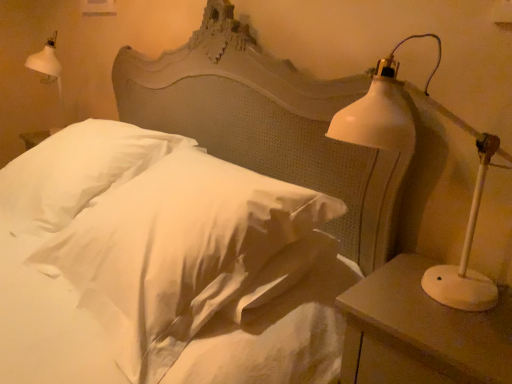
Question: Considering the relative sizes of white soft pillow at center, the 2th pillow in the right-to-left sequence, and white matte nightstand at right in the image provided, is white soft pillow at center, the 2th pillow in the right-to-left sequence, taller than white matte nightstand at right?

Choices:
 (A) yes
 (B) no

Answer: (B)

Question: Is white soft pillow at center, the first pillow from the left, smaller than white matte nightstand at right?

Choices:
 (A) yes
 (B) no

Answer: (B)

Question: Is white matte nightstand at right located within white soft pillow at center, the first pillow from the left?

Choices:
 (A) yes
 (B) no

Answer: (B)

Question: Would you say white soft pillow at center, the 2th pillow in the right-to-left sequence, is outside white matte nightstand at right?

Choices:
 (A) yes
 (B) no

Answer: (A)

Question: Are white soft pillow at center, the 2th pillow in the right-to-left sequence, and white matte nightstand at right far apart?

Choices:
 (A) no
 (B) yes

Answer: (B)

Question: Is point (437, 271) closer or farther from the camera than point (134, 160)?

Choices:
 (A) farther
 (B) closer

Answer: (B)

Question: Looking at the image, does white matte lamp at right seem bigger or smaller compared to white soft pillow at center, the first pillow from the left?

Choices:
 (A) big
 (B) small

Answer: (B)

Question: Visually, is white matte lamp at right positioned to the left or to the right of white soft pillow at center, the first pillow from the left?

Choices:
 (A) right
 (B) left

Answer: (A)

Question: From the image's perspective, relative to white soft pillow at center, the first pillow from the left, is white matte lamp at right above or below?

Choices:
 (A) below
 (B) above

Answer: (A)

Question: Considering the relative positions of white satin pillow at center, the first pillow when ordered from right to left, and white matte nightstand at right in the image provided, is white satin pillow at center, the first pillow when ordered from right to left, to the left or to the right of white matte nightstand at right?

Choices:
 (A) right
 (B) left

Answer: (B)

Question: From their relative heights in the image, would you say white satin pillow at center, which is the 2th pillow from left to right, is taller or shorter than white matte nightstand at right?

Choices:
 (A) short
 (B) tall

Answer: (A)

Question: Considering the positions of point (254, 301) and point (430, 261), is point (254, 301) closer or farther from the camera than point (430, 261)?

Choices:
 (A) farther
 (B) closer

Answer: (B)

Question: From the image's perspective, is white satin pillow at center, which is the 2th pillow from left to right, above or below white matte nightstand at right?

Choices:
 (A) below
 (B) above

Answer: (B)

Question: Visually, is white soft pillow at center, the first pillow from the left, positioned to the left or to the right of white satin pillow at center, which is the 2th pillow from left to right?

Choices:
 (A) left
 (B) right

Answer: (A)

Question: In terms of size, does white soft pillow at center, the first pillow from the left, appear bigger or smaller than white satin pillow at center, which is the 2th pillow from left to right?

Choices:
 (A) small
 (B) big

Answer: (B)